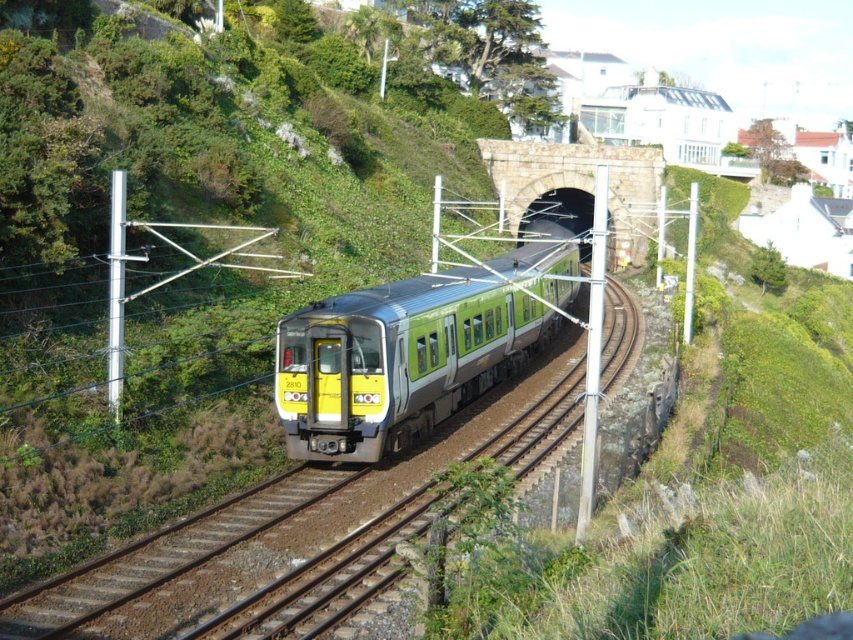
You are a railway inspector who needs to ensure the tracks are properly maintained. You observe the metallic silver track at center and the brown gravel train track at center. Which track has a greater width?

The metallic silver track at center has a greater width than the brown gravel train track at center.

You are standing on the platform watching the green metallic train at center and the metallic silver track at center. Which object is closer to you?

The green metallic train at center is closer to you than the metallic silver track at center.

You are a photographer standing on the railway platform. You want to take a photo of the green metallic train at center and the brown gravel train track at center. Which object will appear taller in your photo?

The green metallic train at center appears taller in the photo because it has a greater height compared to the brown gravel train track at center.